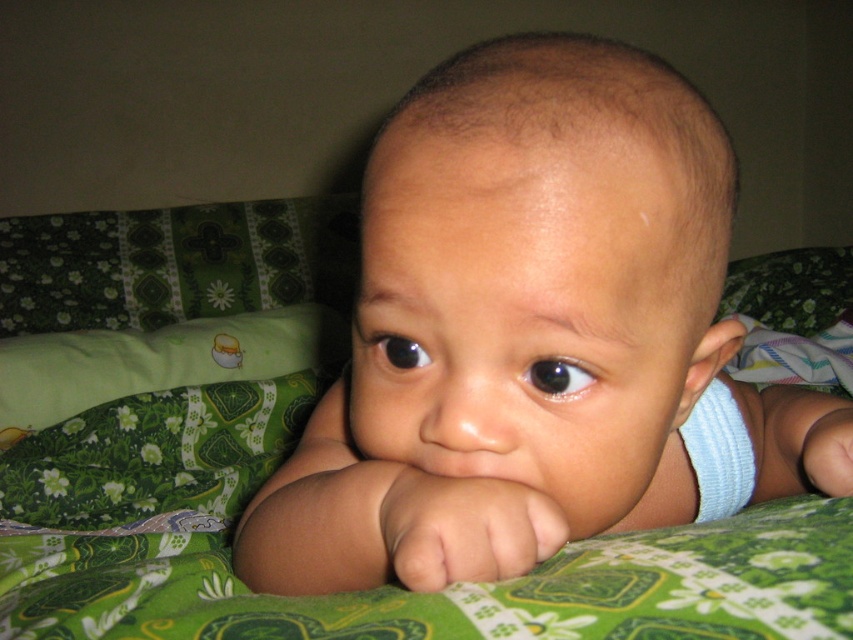
You are a photographer adjusting your camera to focus on two points in the image. The first point is at coordinate point [434,120] and the second is at point [263,314]. Which point should you focus on first if you want to capture the closest object to the camera?

Point [434,120] is closer to the viewer than point [263,314], so you should focus on point [434,120] first to capture the closest object.

You are holding a toy that is 18 inches long. You want to place it on the spot marked by point (683, 506) so that the baby can reach it. Is the toy long enough to reach the baby from your current position?

The distance between the viewer and point (683, 506) is 20.06 inches. Since the toy is only 18 inches long, it is not long enough to reach the baby from your current position.

You are a photographer aiming to capture the baby in the scene. If you want to focus on the smooth skin baby at center without the green fabric pillow at center appearing in the shot, where should you position your camera?

The smooth skin baby at center is above the green fabric pillow at center, so positioning the camera directly above the baby would allow you to focus on the baby while avoiding the pillow in the frame.